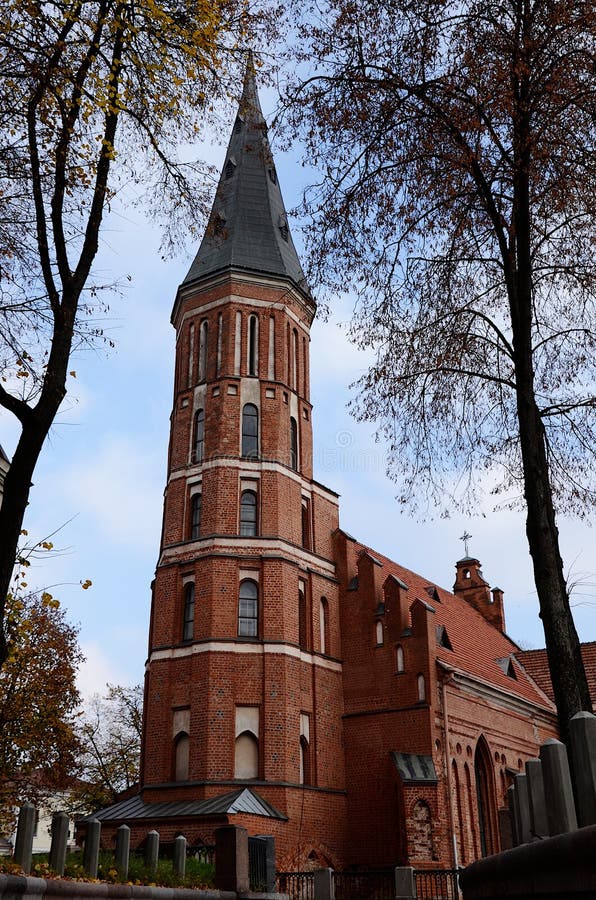
Identify the location of arched opening. The image size is (596, 900). (483, 745).